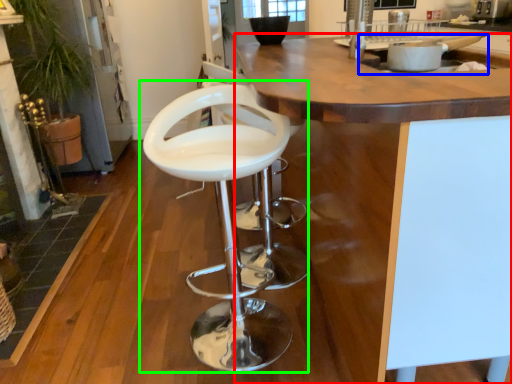
Question: Which object is the closest to the countertop (highlighted by a red box)? Choose among these: sink (highlighted by a blue box) or chair (highlighted by a green box).

Choices:
 (A) sink
 (B) chair

Answer: (A)